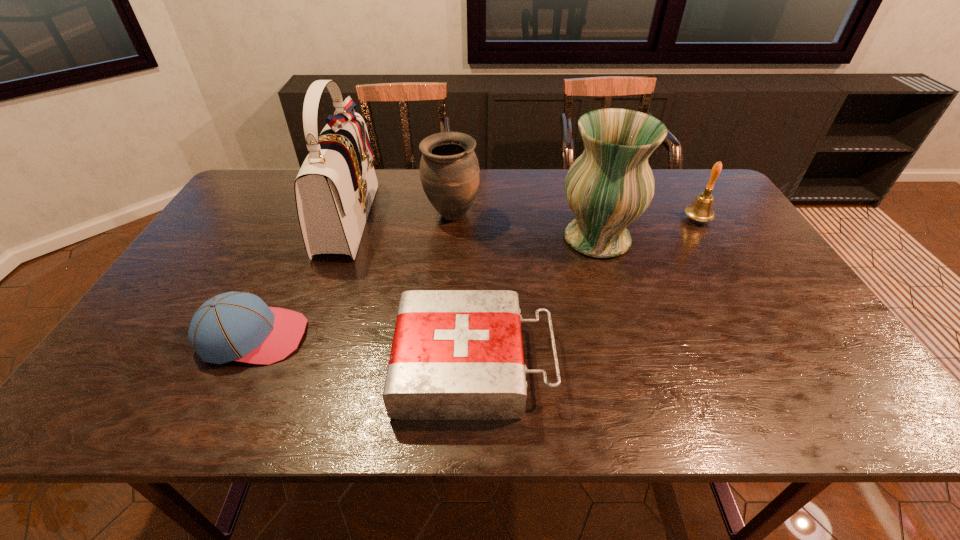
Where is `object that is the nearest to the second object from right to left`? The image size is (960, 540). object that is the nearest to the second object from right to left is located at coordinates (701, 210).

Identify the location of the third closest object to the fourth shortest object. (456, 354).

Where is `vacant point that satisfies the following two spatial constraints: 1. on the front-facing side of the second object from right to left; 2. on the left side of the tallest object`? This screenshot has height=540, width=960. vacant point that satisfies the following two spatial constraints: 1. on the front-facing side of the second object from right to left; 2. on the left side of the tallest object is located at coordinates (341, 239).